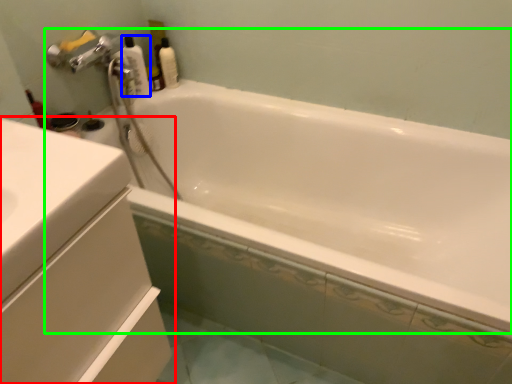
Question: Considering the real-world distances, which object is closest to bathroom cabinet (highlighted by a red box)? cleaning product (highlighted by a blue box) or bathtub (highlighted by a green box).

Choices:
 (A) cleaning product
 (B) bathtub

Answer: (B)